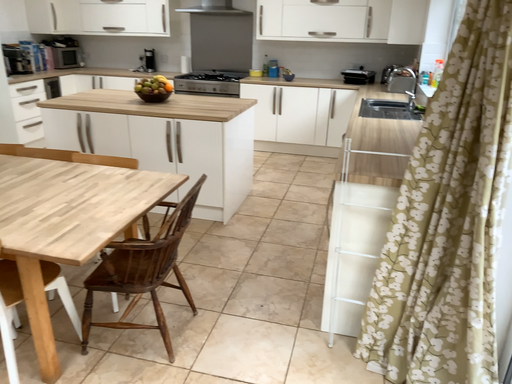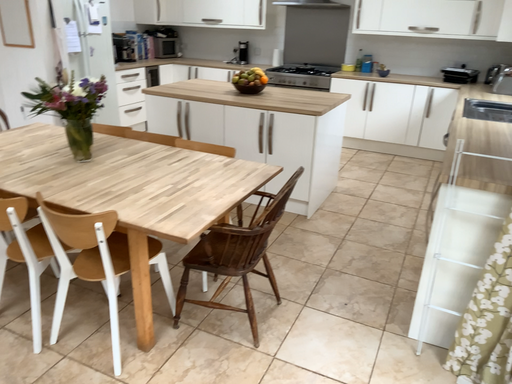
Question: Which way did the camera rotate in the video?

Choices:
 (A) rotated left
 (B) rotated right

Answer: (A)